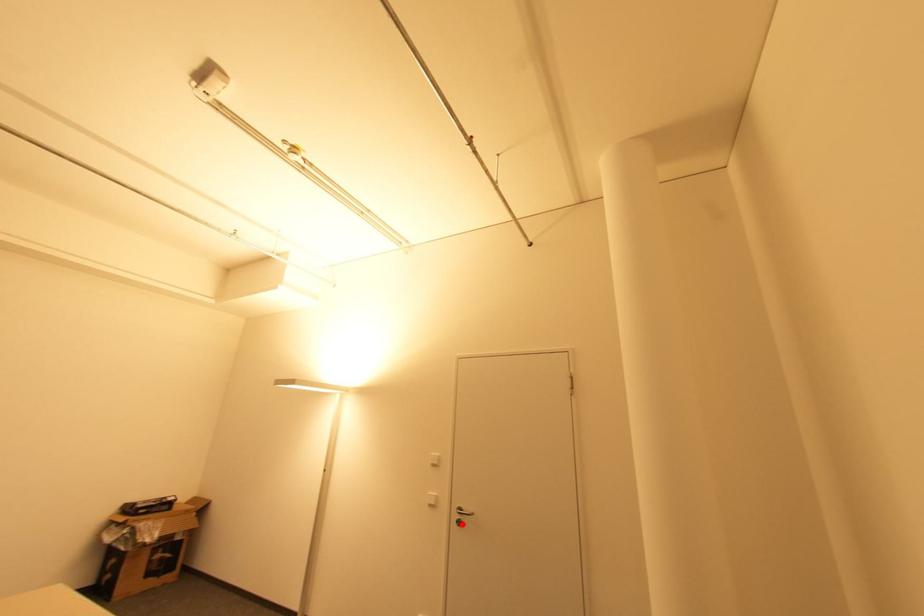
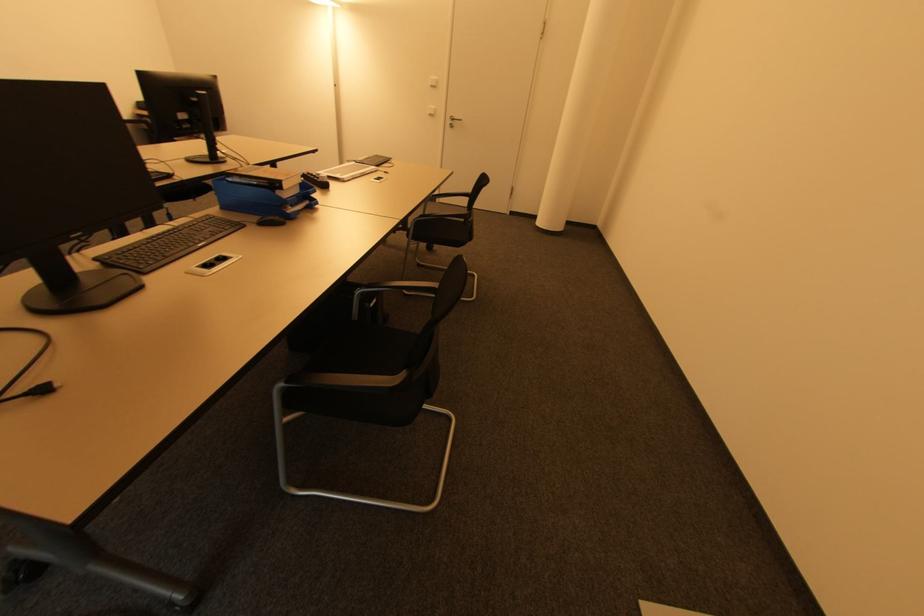
Where in the second image is the point corresponding to the highlighted location from the first image?

(454, 127)